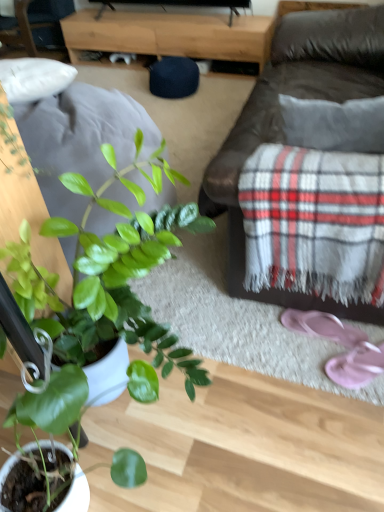
Question: Relative to green matte plant at lower left, is pink fabric flip-flops at lower right, the 1th footwear viewed from the back, in front or behind?

Choices:
 (A) front
 (B) behind

Answer: (B)

Question: In terms of height, does pink fabric flip-flops at lower right, the 2th footwear positioned from the front, look taller or shorter compared to green matte plant at lower left?

Choices:
 (A) short
 (B) tall

Answer: (A)

Question: Which object is the farthest from the wooden tv stand at center?

Choices:
 (A) pink fabric flip-flops at lower right, the 2th footwear positioned from the front
 (B) brown leather couch at center
 (C) pink fabric flip-flops at lower right, the 2th footwear from the back
 (D) green matte plant at lower left

Answer: (A)

Question: Based on their relative distances, which object is farther from the pink fabric flip-flops at lower right, the 1th footwear viewed from the back?

Choices:
 (A) brown leather couch at center
 (B) green matte plant at lower left
 (C) wooden tv stand at center
 (D) pink fabric flip-flops at lower right, the 2th footwear from the back

Answer: (C)